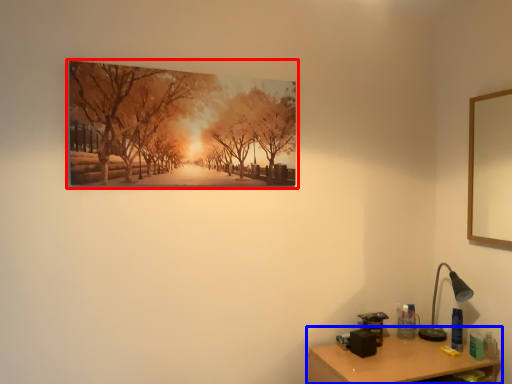
Question: Which point is further to the camera, picture frame (highlighted by a red box) or table (highlighted by a blue box)?

Choices:
 (A) picture frame
 (B) table

Answer: (B)